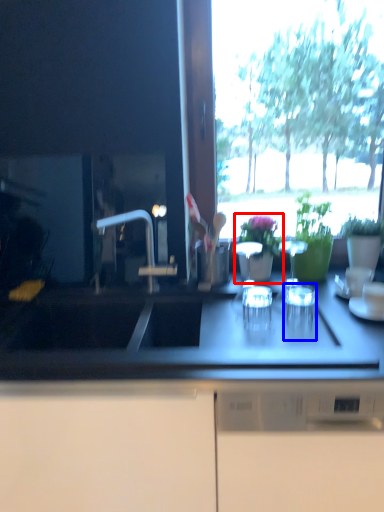
Question: Which of the following is the closest to the observer, houseplant (highlighted by a red box) or tableware (highlighted by a blue box)?

Choices:
 (A) houseplant
 (B) tableware

Answer: (B)